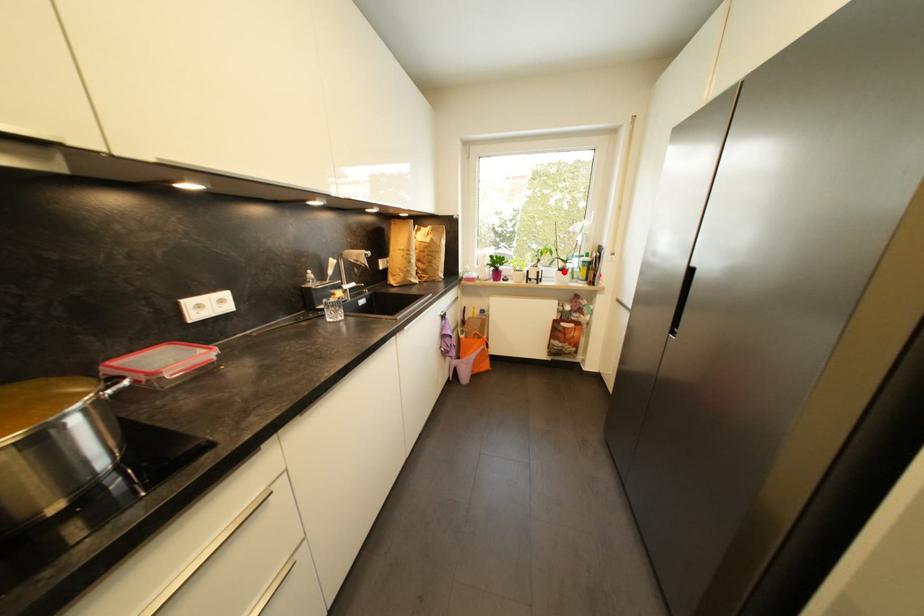
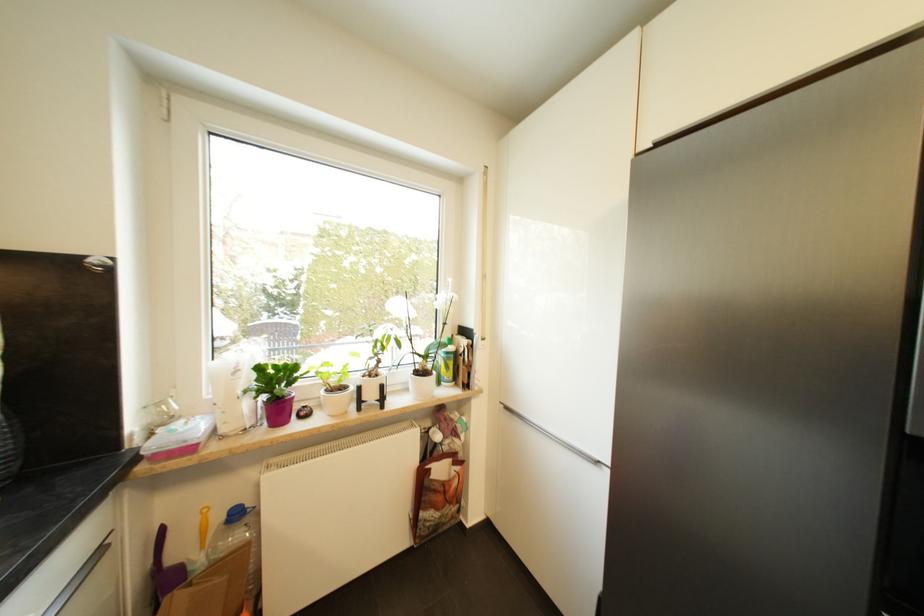
In the second image, find the point that corresponds to the highlighted location in the first image.

(421, 375)